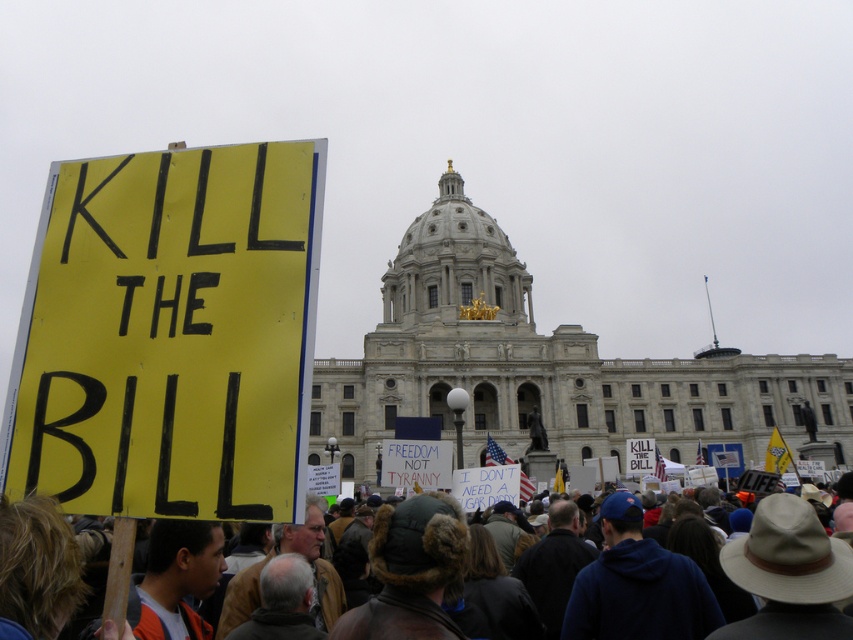
You are a journalist taking photos of the protest. You need to capture both the yellow paper sign at left and the brown leather jacket at lower center in the same frame. Which object should you zoom in on to ensure both are visible without cropping?

You should zoom in on the brown leather jacket at lower center because the yellow paper sign at left is smaller in width than the brown leather jacket at lower center, so focusing on the larger object allows both to fit within the frame.

Based on the scene description, if you were standing in the crowd facing the building, which object would you see first between the yellow paper sign at left and the brown leather jacket at lower center?

The yellow paper sign at left is located above the brown leather jacket at lower center, so you would see the yellow paper sign at left first since it is higher up in your field of view.